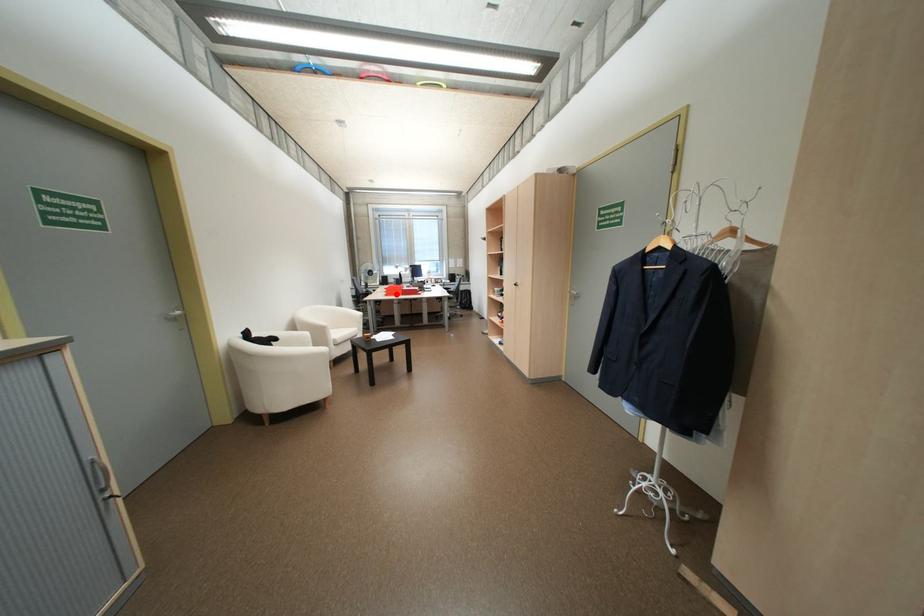
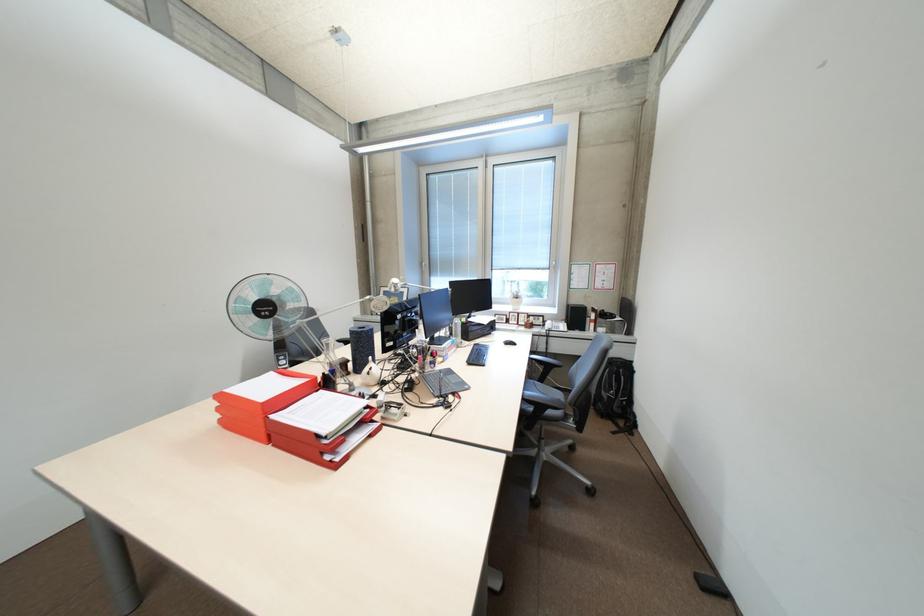
Question: I am providing you with two images of the same scene from different viewpoints. In image1, a red point is highlighted. Considering the same 3D point in image2, which of the following is correct?

Choices:
 (A) It is closer
 (B) It is farther

Answer: (B)